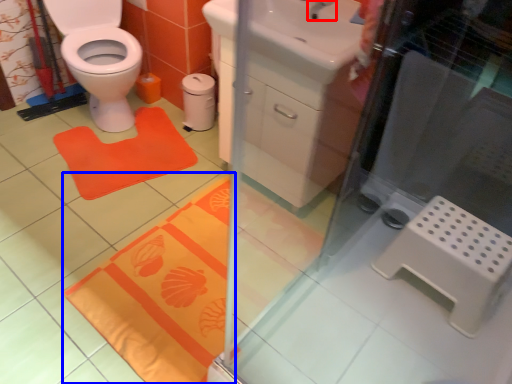
Question: Which object appears closest to the camera in this image, tap (highlighted by a red box) or bath mat (highlighted by a blue box)?

Choices:
 (A) tap
 (B) bath mat

Answer: (B)